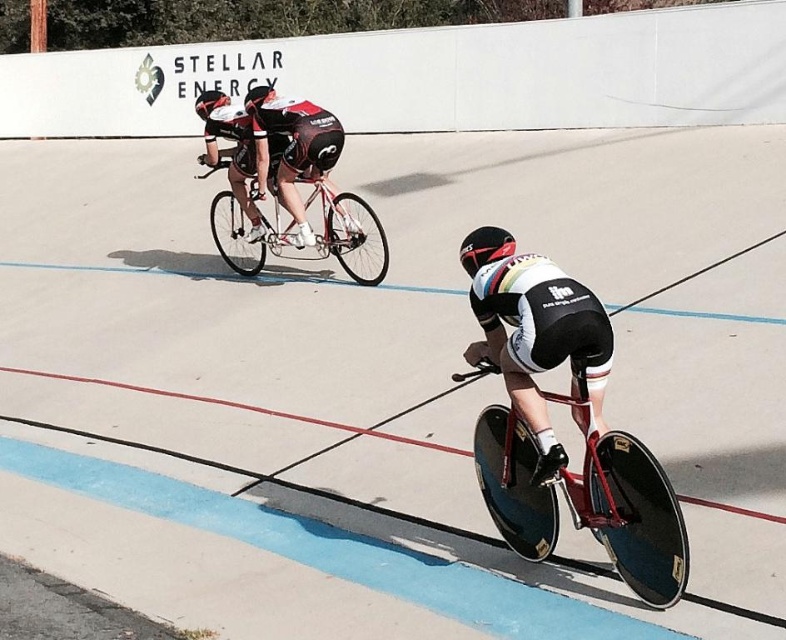
You are a spectator at the velodrome and want to take a photo of both the shiny red bike at lower right and the shiny metallic bicycle at center. Based on their positions, which bike should you focus on first to ensure both are in the frame?

The shiny red bike at lower right is located below the shiny metallic bicycle at center, so you should focus on the shiny metallic bicycle at center first to ensure both are in the frame.

You are standing on the edge of the velodrome track and see the shiny black bicycle at center. If you want to pick up an object that is 3 meters away from you, will you be able to reach it without moving?

The shiny black bicycle at center is 4.10 meters away from you, so you cannot reach it without moving since it is farther than 3 meters.

You are standing at the point labeled as point (505, 413) in a velodrome. You want to watch a cyclist race that starts from the starting line 15 feet away from you. Is the starting line likely located at your current position or somewhere else?

The point (505, 413) is 14.94 feet away from the viewer, so the starting line is likely located at the viewer position since it is almost exactly 15 feet away from the point.